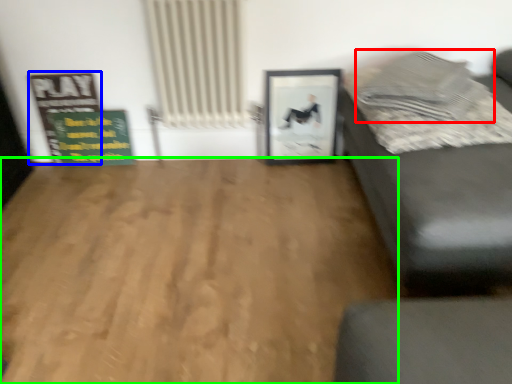
Question: Based on their relative distances, which object is nearer to pillow (highlighted by a red box)? Choose from bulletin board (highlighted by a blue box) and hardwood (highlighted by a green box).

Choices:
 (A) bulletin board
 (B) hardwood

Answer: (B)